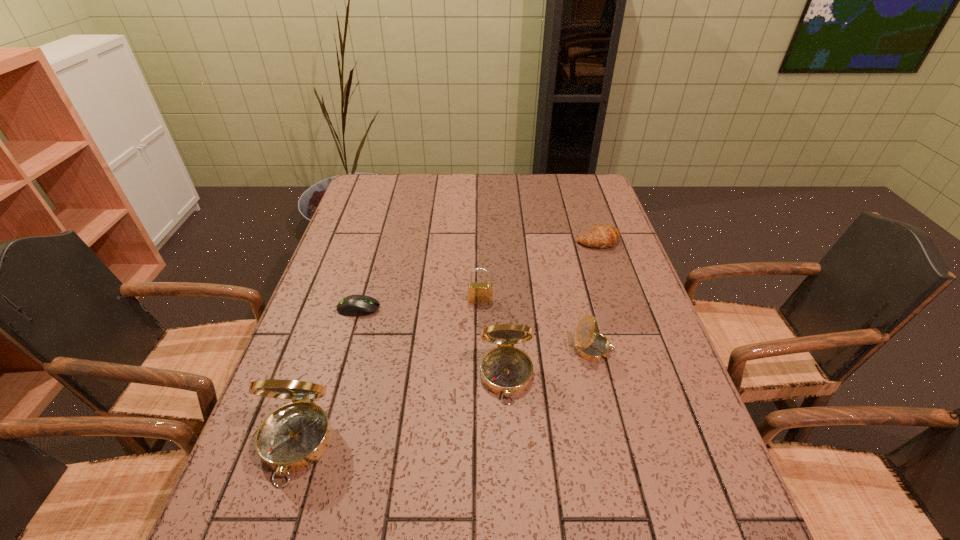
Identify the location of the nearest object. (294, 436).

What are the coordinates of `the nearest compass` in the screenshot? It's located at (294, 436).

Locate an element on the screen. The height and width of the screenshot is (540, 960). the second compass from right to left is located at coordinates (506, 370).

At what (x,y) coordinates should I click in order to perform the action: click on the fifth shortest object. Please return your answer as a coordinate pair (x, y). Image resolution: width=960 pixels, height=540 pixels. Looking at the image, I should click on (506, 370).

You are a GUI agent. You are given a task and a screenshot of the screen. Output one action in this format:
    pyautogui.click(x=<x>, y=<y>)
    Task: Click on the rightmost compass
    
    Given the screenshot: What is the action you would take?
    pyautogui.click(x=590, y=345)

The image size is (960, 540). I want to click on the farthest object, so click(601, 236).

Identify the location of the fifth tallest object. The width and height of the screenshot is (960, 540). (601, 236).

Where is `the shortest object`? the shortest object is located at coordinates coord(354,305).

Locate an element on the screen. Image resolution: width=960 pixels, height=540 pixels. padlock is located at coordinates (477, 292).

At what (x,y) coordinates should I click in order to perform the action: click on blank area located 0.120m with the dial facing the fifth shortest object. Please return your answer as a coordinate pair (x, y). Image resolution: width=960 pixels, height=540 pixels. Looking at the image, I should click on (511, 459).